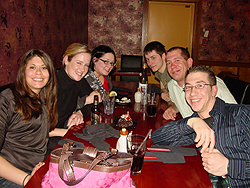
Image resolution: width=250 pixels, height=188 pixels. I want to click on door, so click(175, 34).